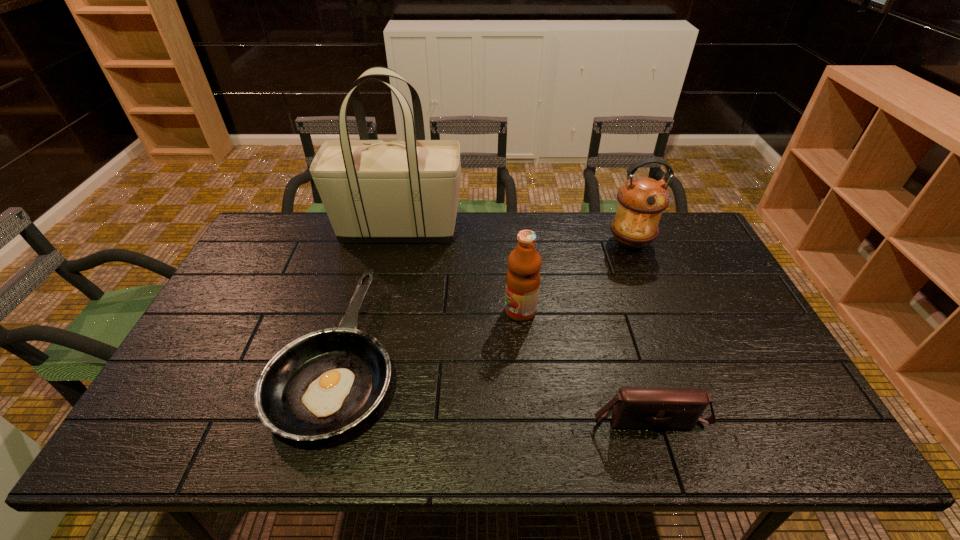
The width and height of the screenshot is (960, 540). Identify the location of blank region between the oil lamp and the shoulder bag. (639, 329).

At what (x,y) coordinates should I click in order to perform the action: click on vacant space that's between the shoulder bag and the oil lamp. Please return your answer as a coordinate pair (x, y). The image size is (960, 540). Looking at the image, I should click on (639, 329).

The image size is (960, 540). I want to click on free area in between the third object from left to right and the oil lamp, so click(575, 277).

You are a GUI agent. You are given a task and a screenshot of the screen. Output one action in this format:
    pyautogui.click(x=<x>, y=<y>)
    Task: Click on the free space between the fruit juice and the shortest object
    This screenshot has width=960, height=540.
    Given the screenshot: What is the action you would take?
    pyautogui.click(x=430, y=333)

Where is `free space between the shoulder bag and the oil lamp`? This screenshot has height=540, width=960. free space between the shoulder bag and the oil lamp is located at coordinates pyautogui.click(x=639, y=329).

Where is `free space between the tallest object and the fruit juice`? free space between the tallest object and the fruit juice is located at coordinates (460, 270).

I want to click on vacant area between the third object from right to left and the tallest object, so click(x=460, y=270).

Where is `free space that is in between the second shortest object and the oil lamp`? Image resolution: width=960 pixels, height=540 pixels. free space that is in between the second shortest object and the oil lamp is located at coordinates (639, 329).

Where is `vacant space that is in between the tallest object and the shortest object`? vacant space that is in between the tallest object and the shortest object is located at coordinates (370, 292).

Image resolution: width=960 pixels, height=540 pixels. Identify the location of object that is the second nearest to the tallest object. (524, 263).